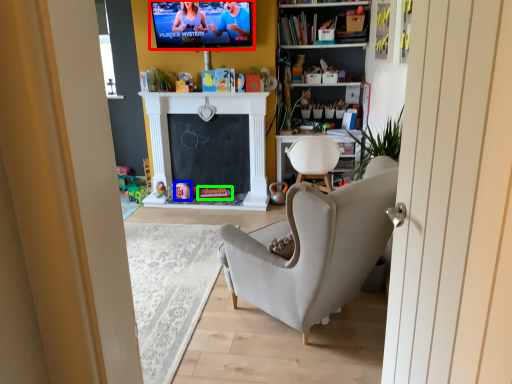
Question: Estimate the real-world distances between objects in this image. Which object is farther from tv show (highlighted by a red box), toy (highlighted by a blue box) or toy (highlighted by a green box)?

Choices:
 (A) toy
 (B) toy

Answer: (B)